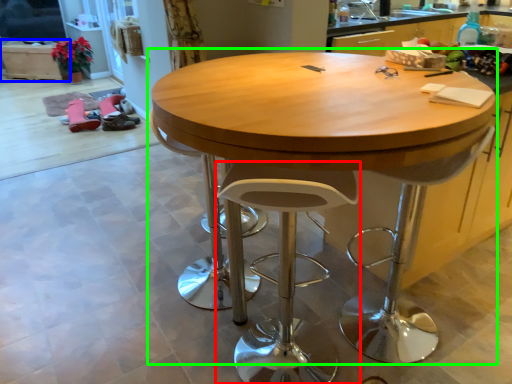
Question: Which object is positioned closest to stool (highlighted by a red box)? Select from cabinetry (highlighted by a blue box) and table (highlighted by a green box).

Choices:
 (A) cabinetry
 (B) table

Answer: (B)